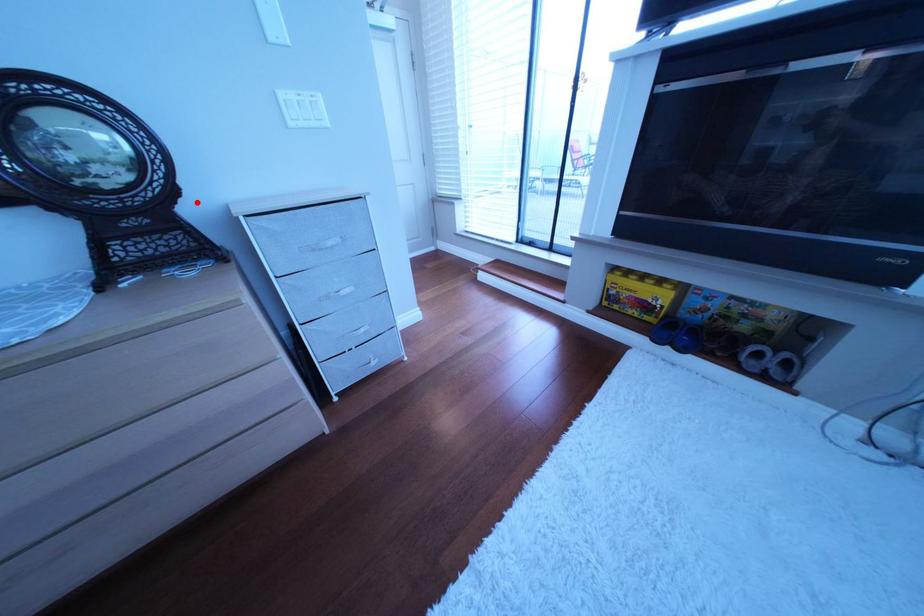
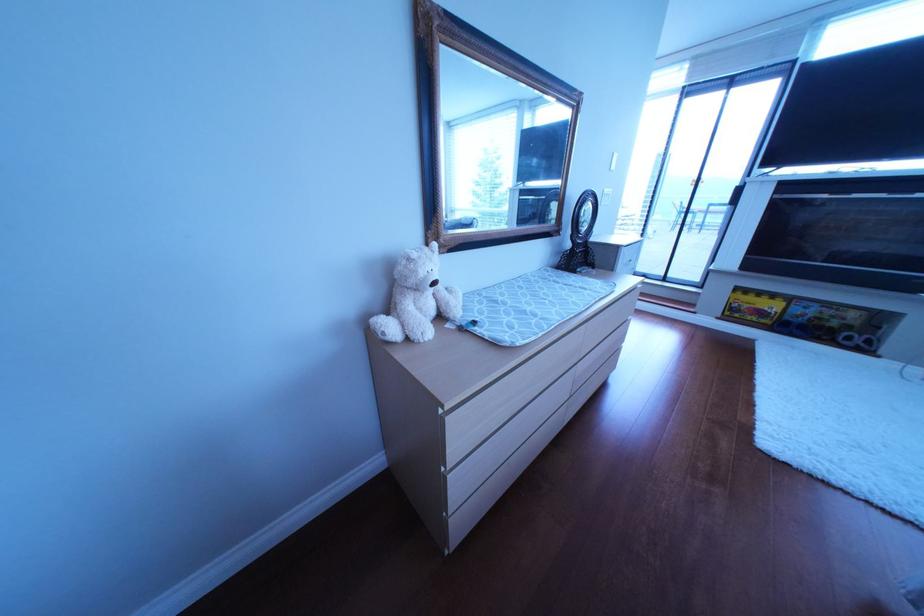
In the second image, find the point that corresponds to the highlighted location in the first image.

(605, 240)